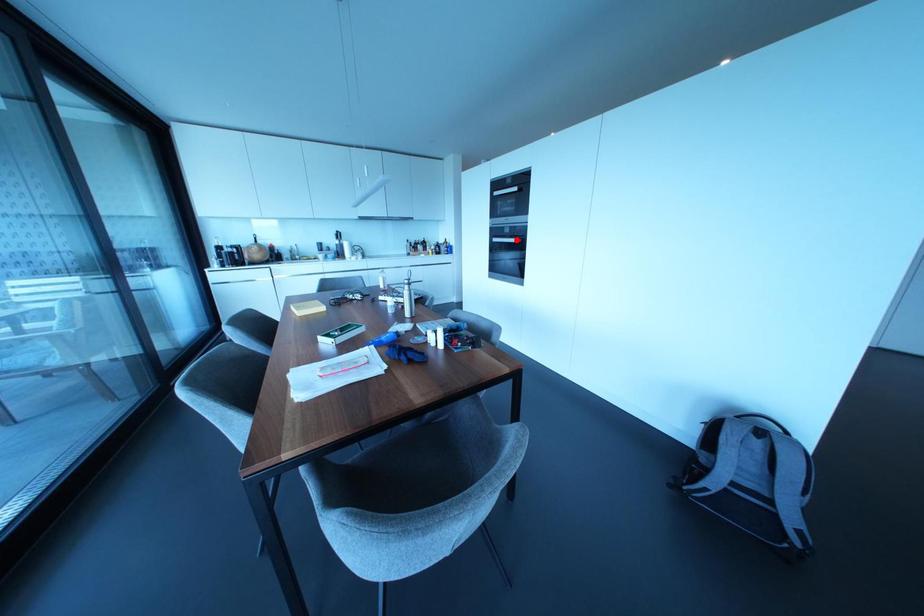
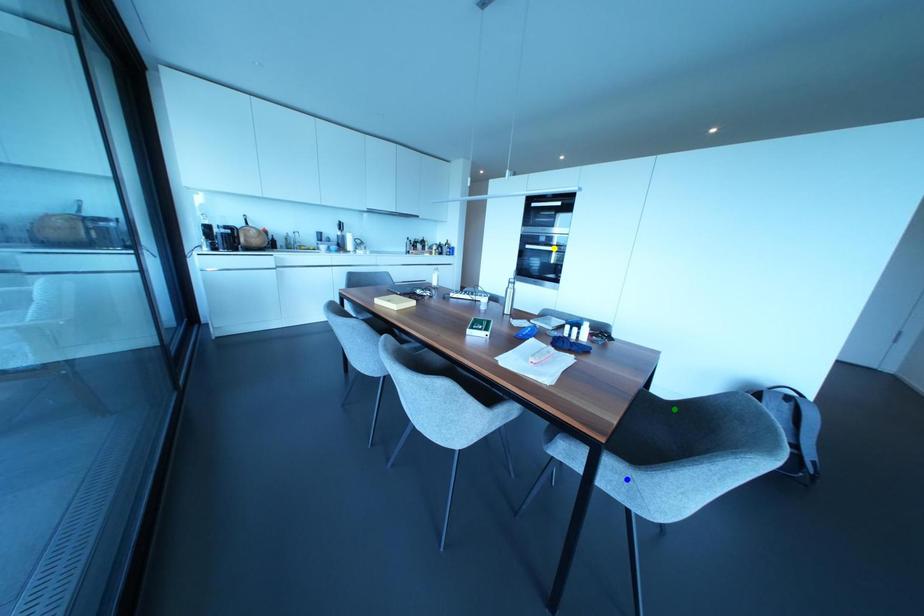
Question: I am providing you with two images of the same scene from different viewpoints. A red point is marked on the first image. You are given multiple points on the second image. Which point in image 2 is actually the same real-world point as the red point in image 1?

Choices:
 (A) green point
 (B) yellow point
 (C) blue point

Answer: (B)